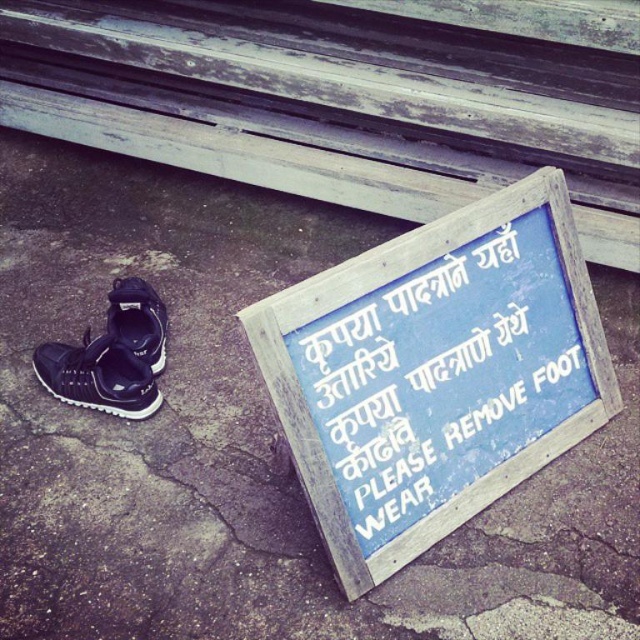
Between wooden park bench at upper center and black matte sneaker at lower left, which one has more height?

wooden park bench at upper center is taller.

Which is above, wooden park bench at upper center or black matte sneaker at lower left?

wooden park bench at upper center

Between point (240, 38) and point (122, 349), which one is positioned in front?

Point (122, 349) is in front.

Where is `wooden park bench at upper center`? wooden park bench at upper center is located at coordinates (348, 97).

Describe the element at coordinates (435, 372) in the screenshot. I see `blue wooden sign at lower center` at that location.

Image resolution: width=640 pixels, height=640 pixels. I want to click on blue wooden sign at lower center, so click(x=435, y=372).

You are a GUI agent. You are given a task and a screenshot of the screen. Output one action in this format:
    pyautogui.click(x=<x>, y=<y>)
    Task: Click on the blue wooden sign at lower center
    The height and width of the screenshot is (640, 640).
    Given the screenshot: What is the action you would take?
    pyautogui.click(x=435, y=372)

Is wooden park bench at upper center to the left of black matte shoe at left from the viewer's perspective?

In fact, wooden park bench at upper center is to the right of black matte shoe at left.

Can you confirm if wooden park bench at upper center is shorter than black matte shoe at left?

No, wooden park bench at upper center is not shorter than black matte shoe at left.

Where is `wooden park bench at upper center`? wooden park bench at upper center is located at coordinates (348, 97).